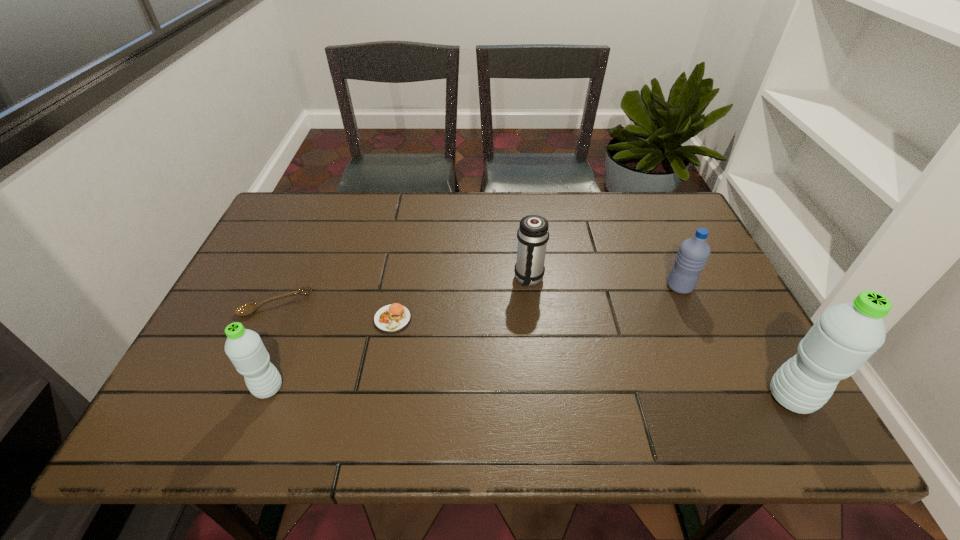
If the aim is uniform spacing by inserting an additional water_bottle among them, please point to a vacant space for this new water_bottle. Please provide its 2D coordinates. Your answer should be formatted as a tuple, i.e. [(x, y)], where the tuple contains the x and y coordinates of a point satisfying the conditions above.

[(527, 393)]